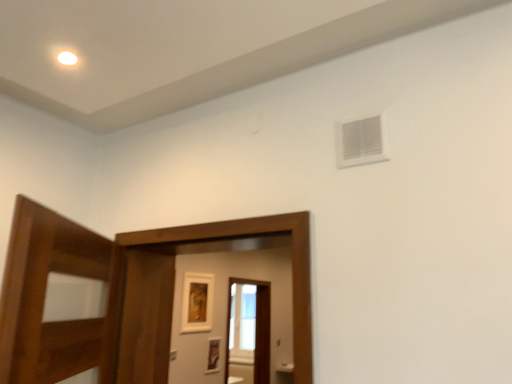
Question: From a real-world perspective, is transparent glass screen door at center, the first screen door when ordered from bottom to top, above or below white plastic vent at upper right?

Choices:
 (A) above
 (B) below

Answer: (B)

Question: Visually, is transparent glass screen door at center, arranged as the 2th screen door when viewed from the front, positioned to the left or to the right of white plastic vent at upper right?

Choices:
 (A) left
 (B) right

Answer: (A)

Question: Which object is the farthest from the brown wooden screen door at center, arranged as the second screen door when viewed from the back?

Choices:
 (A) matte gold picture frame at center, which is the second picture frame in bottom-to-top order
 (B) matte gold picture frame at center, positioned as the second picture frame in top-to-bottom order
 (C) transparent glass screen door at center, which is the 1th screen door from back to front
 (D) white plastic vent at upper right

Answer: (B)

Question: Which is farther from the matte gold picture frame at center, positioned as the second picture frame in top-to-bottom order?

Choices:
 (A) matte gold picture frame at center, the 1th picture frame from the top
 (B) white plastic vent at upper right
 (C) transparent glass screen door at center, the second screen door from the top
 (D) brown wooden screen door at center, placed as the first screen door when sorted from top to bottom

Answer: (B)